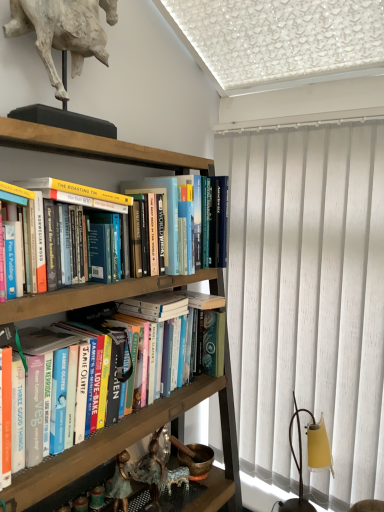
Question: Which direction should I rotate to face hardcover books at center, which is the first book from top to bottom, — up or down?

Choices:
 (A) down
 (B) up

Answer: (B)

Question: Is white plaster horse at upper left thinner than hardcover books at center, which ranks as the 2th book in bottom-to-top order?

Choices:
 (A) no
 (B) yes

Answer: (B)

Question: From a real-world perspective, is white plaster horse at upper left under hardcover books at center, which ranks as the 2th book in bottom-to-top order?

Choices:
 (A) yes
 (B) no

Answer: (B)

Question: Considering the relative positions of white plaster horse at upper left and hardcover books at center, which ranks as the 2th book in bottom-to-top order, in the image provided, is white plaster horse at upper left to the left of hardcover books at center, which ranks as the 2th book in bottom-to-top order, from the viewer's perspective?

Choices:
 (A) yes
 (B) no

Answer: (A)

Question: Can you confirm if white plaster horse at upper left is positioned to the right of hardcover books at center, which is the first book from top to bottom?

Choices:
 (A) no
 (B) yes

Answer: (A)

Question: From a real-world perspective, does white plaster horse at upper left stand above hardcover books at center, which ranks as the 2th book in bottom-to-top order?

Choices:
 (A) no
 (B) yes

Answer: (B)

Question: Is white plaster horse at upper left oriented away from hardcover books at center, which ranks as the 2th book in bottom-to-top order?

Choices:
 (A) no
 (B) yes

Answer: (A)

Question: From the image's perspective, is white plaster horse at upper left located above hardcover books at center, which is the second book in top-to-bottom order?

Choices:
 (A) yes
 (B) no

Answer: (A)

Question: Can you confirm if white plaster horse at upper left is shorter than hardcover books at center, which is the second book in top-to-bottom order?

Choices:
 (A) yes
 (B) no

Answer: (B)

Question: Does white plaster horse at upper left turn towards hardcover books at center, which appears as the 1th book when ordered from the bottom?

Choices:
 (A) no
 (B) yes

Answer: (A)

Question: Is white plaster horse at upper left next to hardcover books at center, which is the second book in top-to-bottom order?

Choices:
 (A) yes
 (B) no

Answer: (B)

Question: Could hardcover books at center, which is the second book in top-to-bottom order, be considered to be inside white plaster horse at upper left?

Choices:
 (A) no
 (B) yes

Answer: (A)

Question: Is white plaster horse at upper left positioned in front of hardcover books at center, which is the second book in top-to-bottom order?

Choices:
 (A) yes
 (B) no

Answer: (B)

Question: Is wooden bookshelf at upper left oriented towards white vertical blinds at right?

Choices:
 (A) no
 (B) yes

Answer: (A)